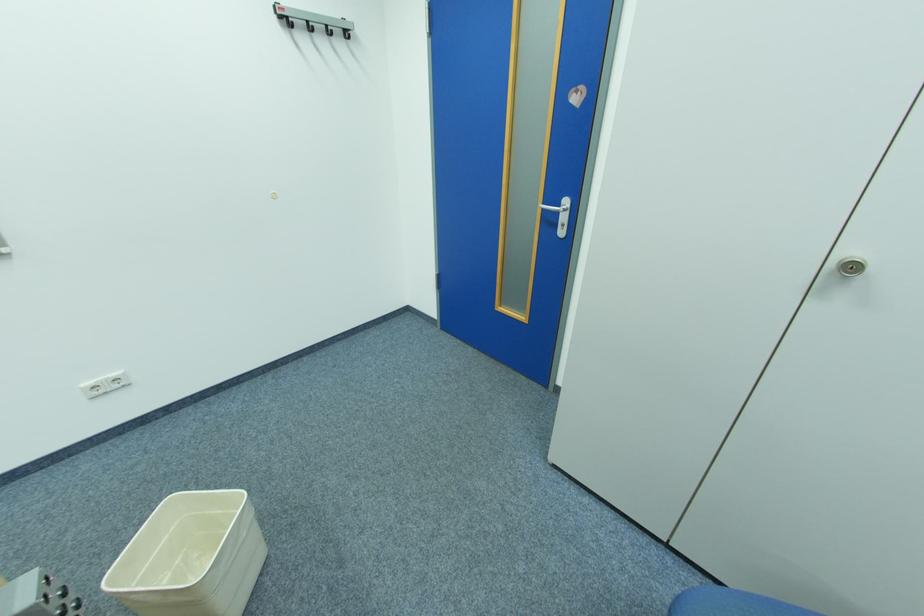
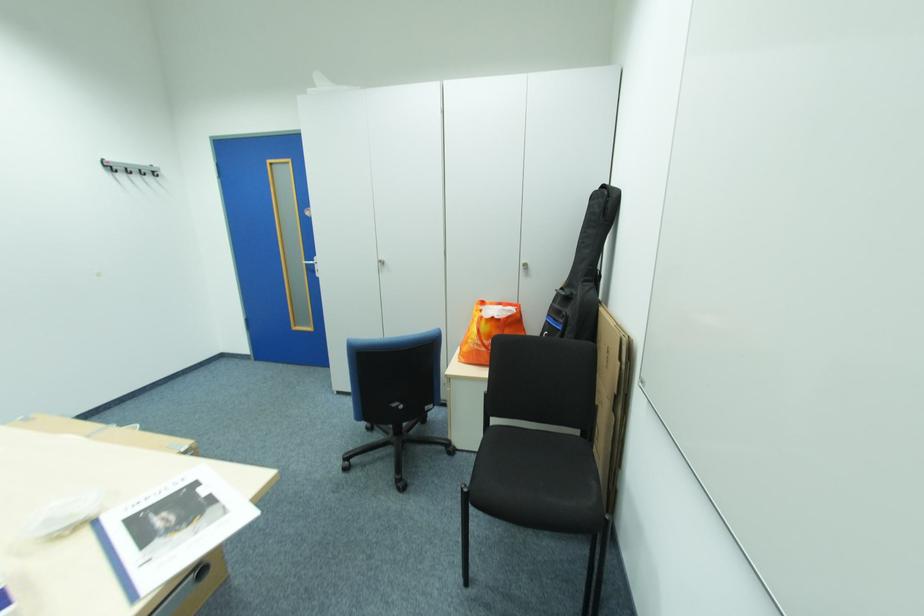
Find the pixel in the second image that matches [552,209] in the first image.

(314, 265)